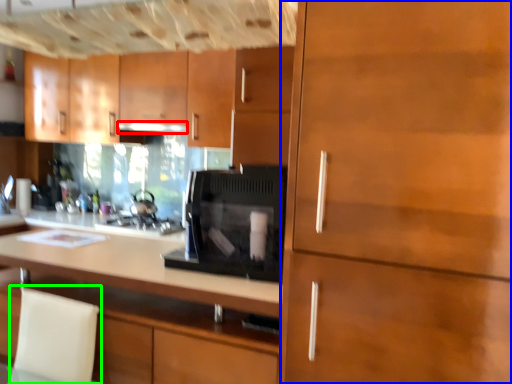
Question: Which object is the farthest from exhaust hood (highlighted by a red box)? Choose among these: cabinetry (highlighted by a blue box) or swivel chair (highlighted by a green box).

Choices:
 (A) cabinetry
 (B) swivel chair

Answer: (A)